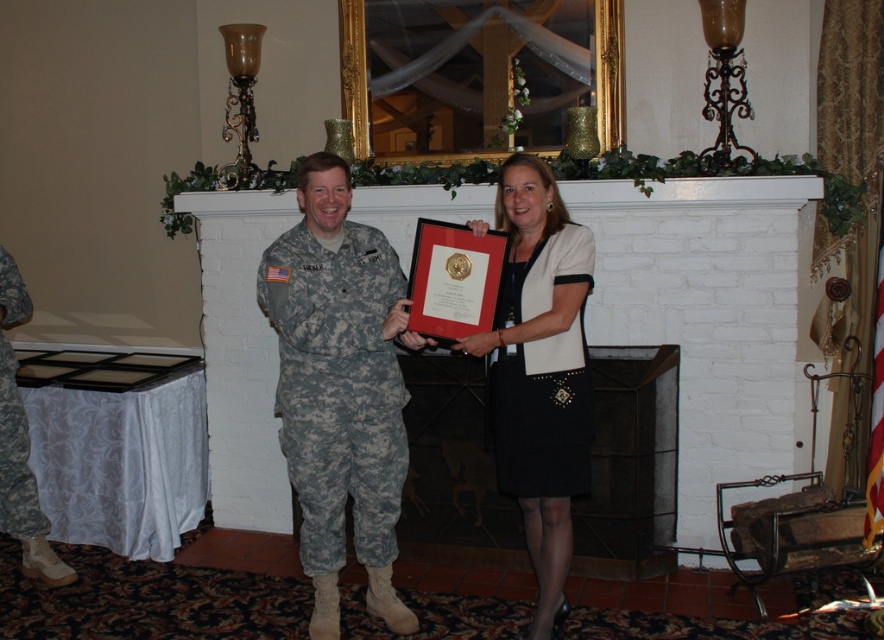
Question: Is camouflage fabric uniform at center closer to camera compared to black satin dress at center?

Choices:
 (A) yes
 (B) no

Answer: (B)

Question: Estimate the real-world distances between objects in this image. Which object is closer to the camouflage fabric uniform at center?

Choices:
 (A) camouflage fabric uniform at left
 (B) black satin dress at center
 (C) black matte dress at center

Answer: (B)

Question: Is camouflage uniform at center to the left of black matte dress at center from the viewer's perspective?

Choices:
 (A) yes
 (B) no

Answer: (A)

Question: Which object is closer to the camera taking this photo?

Choices:
 (A) camouflage fabric uniform at center
 (B) camouflage fabric uniform at left
 (C) black matte dress at center
 (D) camouflage uniform at center

Answer: (D)

Question: Does camouflage fabric uniform at center appear under black matte dress at center?

Choices:
 (A) yes
 (B) no

Answer: (A)

Question: Which point appears closest to the camera in this image?

Choices:
 (A) (315, 216)
 (B) (497, 476)
 (C) (338, 291)

Answer: (A)